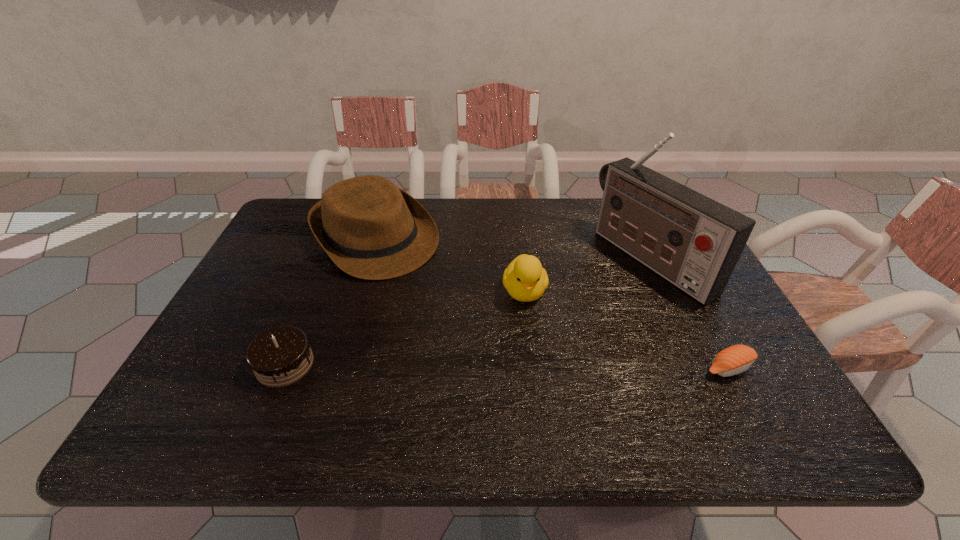
The width and height of the screenshot is (960, 540). I want to click on vacant point located between the fedora and the shortest object, so click(552, 303).

The height and width of the screenshot is (540, 960). Identify the location of vacant space that is in between the fedora and the third object from left to right. (450, 265).

I want to click on blank region between the radio receiver and the fedora, so click(x=513, y=248).

This screenshot has width=960, height=540. Find the location of `vacant area between the chocolate cake and the fedora`. vacant area between the chocolate cake and the fedora is located at coordinates (330, 301).

Select which object is the fourth closest to the shortest object. Please provide its 2D coordinates. Your answer should be formatted as a tuple, i.e. [(x, y)], where the tuple contains the x and y coordinates of a point satisfying the conditions above.

[(280, 356)]

Select which object is the third closest to the sushi. Please provide its 2D coordinates. Your answer should be formatted as a tuple, i.e. [(x, y)], where the tuple contains the x and y coordinates of a point satisfying the conditions above.

[(370, 229)]

Find the location of a particular element. The image size is (960, 540). free space that satisfies the following two spatial constraints: 1. on the front side of the sushi; 2. on the right side of the fedora is located at coordinates (336, 368).

What are the coordinates of `vacant space that satisfies the following two spatial constraints: 1. on the front side of the third object from right to left; 2. on the right side of the fedora` in the screenshot? It's located at (359, 292).

Image resolution: width=960 pixels, height=540 pixels. I want to click on free space that satisfies the following two spatial constraints: 1. on the front side of the fedora; 2. on the left side of the tallest object, so click(x=369, y=259).

At what (x,y) coordinates should I click in order to perform the action: click on free spot that satisfies the following two spatial constraints: 1. on the front side of the fedora; 2. on the left side of the tallest object. Please return your answer as a coordinate pair (x, y). Looking at the image, I should click on (369, 259).